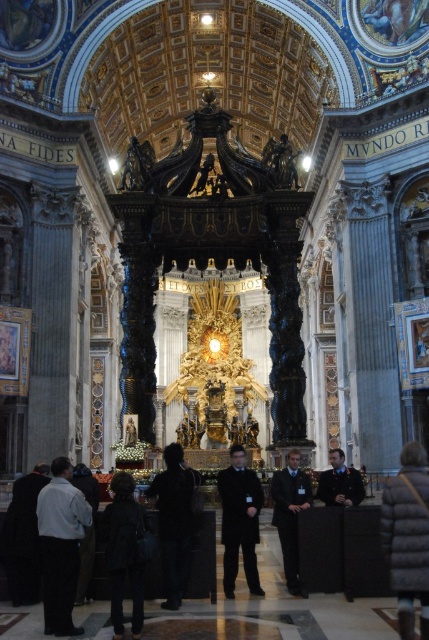
You are a visitor in the cathedral and want to move from the black fuzzy coat at lower right to the black wool coat at lower left. The path is clear, but you have a 14 meter long banner that you need to carry. Can you move the banner horizontally without folding it?

The distance between the black fuzzy coat at lower right and the black wool coat at lower left is 14.59 meters. Since the banner is 14 meters long, you can move it horizontally without folding as the distance is sufficient.

You are a visitor to the cathedral and want to take a photo of the papal throne. However, there are two coats blocking your view. The black matte coat at center and the dark brown leather jacket at center are in the way. Which coat should you move to get a clear view of the throne?

The black matte coat at center is in front of the dark brown leather jacket at center. To get a clear view of the papal throne, you should move the black matte coat at center first since it is closer to you and blocking the view more directly.